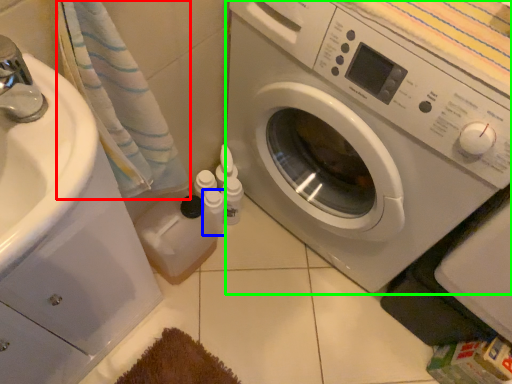
Question: Which object is positioned farthest from bath towel (highlighted by a red box)? Select from toiletry (highlighted by a blue box) and washing machine (highlighted by a green box).

Choices:
 (A) toiletry
 (B) washing machine

Answer: (A)